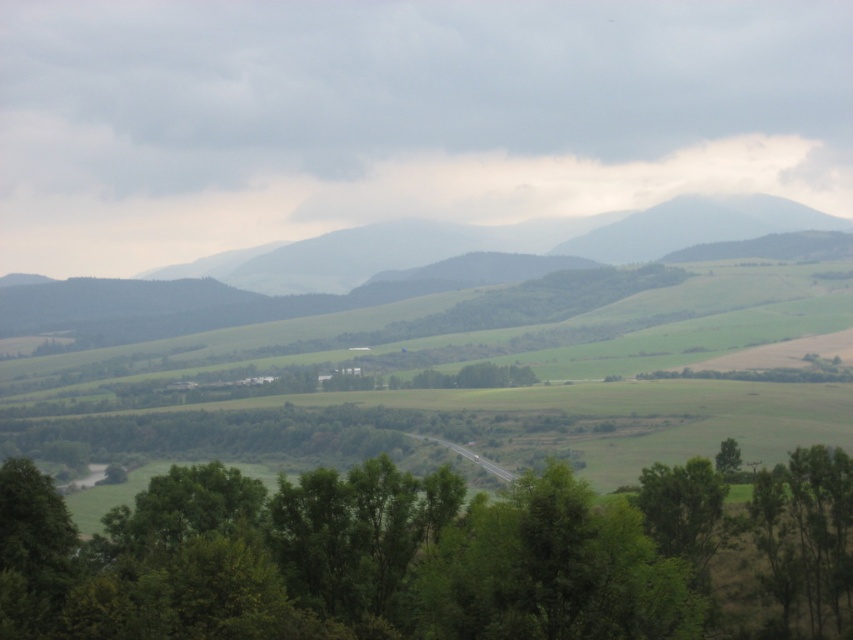
Question: Where is green leafy tree at center located in relation to green leafy tree at lower right in the image?

Choices:
 (A) below
 (B) above

Answer: (B)

Question: Which point is closer to the camera?

Choices:
 (A) (364, 260)
 (B) (338, 632)

Answer: (B)

Question: Does green leafy tree at center have a lesser width compared to green grassy hill at center?

Choices:
 (A) no
 (B) yes

Answer: (B)

Question: Can you confirm if green grassy hill at center is positioned below green leafy tree at lower right?

Choices:
 (A) yes
 (B) no

Answer: (B)

Question: Based on their relative distances, which object is nearer to the green grassy hill at center?

Choices:
 (A) green leafy tree at center
 (B) green leafy tree at lower right

Answer: (B)

Question: Which of the following is the farthest from the observer?

Choices:
 (A) green grassy hill at center
 (B) green leafy tree at center

Answer: (A)